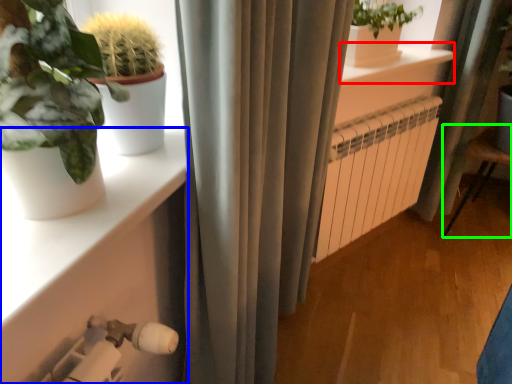
Question: Based on their relative distances, which object is farther from window sill (highlighted by a red box)? Choose from shelf (highlighted by a blue box) and armchair (highlighted by a green box).

Choices:
 (A) shelf
 (B) armchair

Answer: (A)